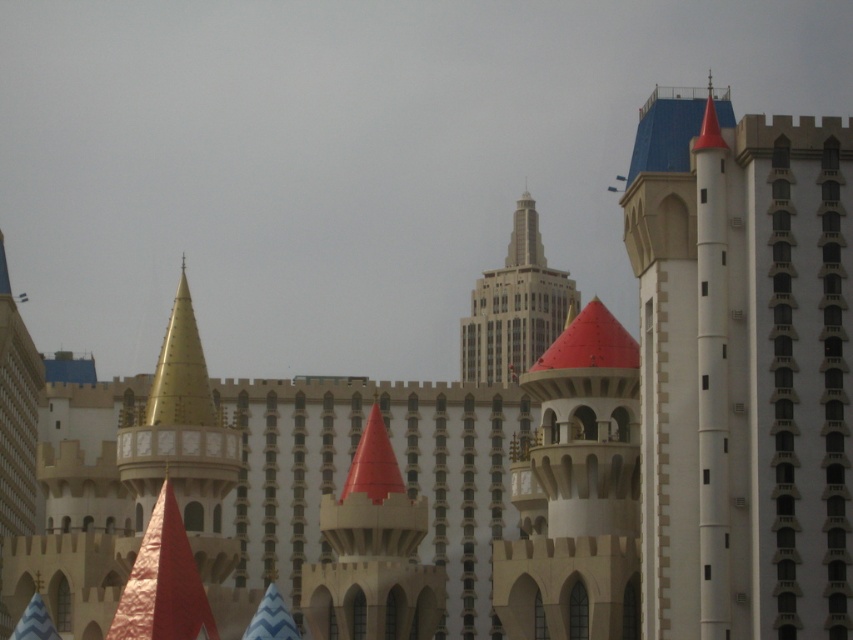
You are an architect analyzing the spatial relationship between the matte gold cone at center and the smooth beige tower at center in the image. Which structure is positioned lower in the scene?

The matte gold cone at center is located below the smooth beige tower at center, so it is positioned lower in the scene.

You are a drone operator who needs to fly a drone between the matte gold cone at center and the smooth beige tower at center. The drone has a maximum flight range of 120 meters. Can the drone safely complete the flight between them without exceeding its range?

The distance between the matte gold cone at center and the smooth beige tower at center is 139.70 meters, which exceeds the drone operator maximum flight range of 120 meters. The drone cannot safely complete the flight between them without exceeding its range.